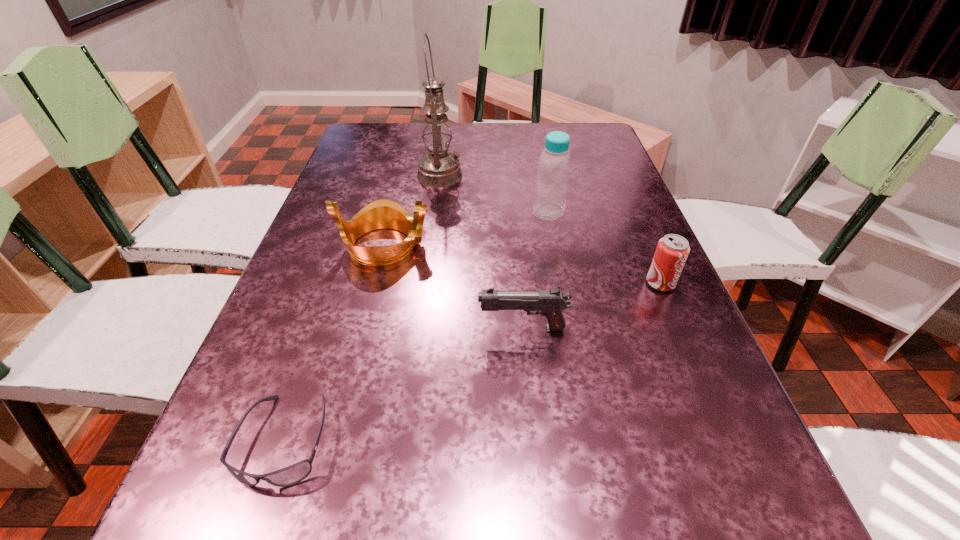
Locate an element on the screen. This screenshot has width=960, height=540. oil lamp is located at coordinates (438, 167).

This screenshot has width=960, height=540. In order to click on the farthest object in this screenshot , I will do `click(438, 167)`.

Where is `the second tallest object`? The width and height of the screenshot is (960, 540). the second tallest object is located at coordinates (554, 165).

Locate an element on the screen. tiara is located at coordinates (383, 213).

Identify the location of soda can. (672, 250).

You are a GUI agent. You are given a task and a screenshot of the screen. Output one action in this format:
    pyautogui.click(x=<x>, y=<y>)
    Task: Click on the fourth farthest object
    The image size is (960, 540).
    Given the screenshot: What is the action you would take?
    click(x=672, y=250)

Where is `the second nearest object`? the second nearest object is located at coordinates (551, 303).

I want to click on sunglasses, so click(x=293, y=474).

The width and height of the screenshot is (960, 540). What are the coordinates of `the nearest object` in the screenshot? It's located at (293, 474).

Locate an element on the screen. This screenshot has height=540, width=960. vacant region located on the front of the tallest object is located at coordinates (435, 213).